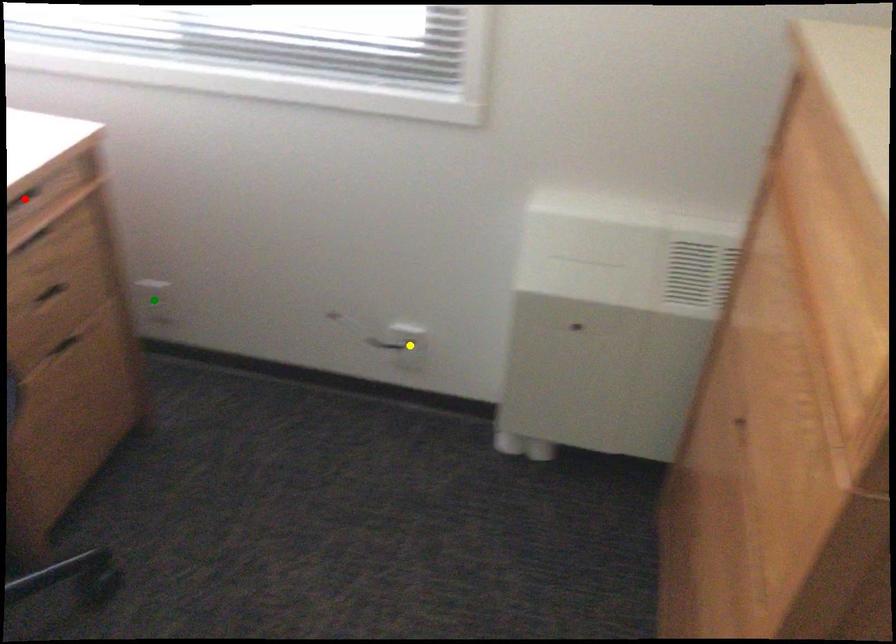
Order these from nearest to farthest:
green point, red point, yellow point

green point < yellow point < red point